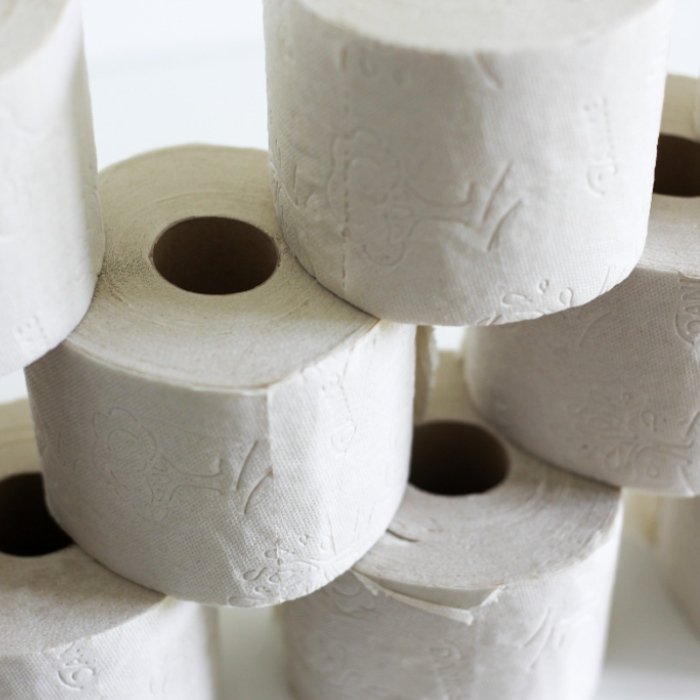
Find the location of `toilet paper rolls`. toilet paper rolls is located at coordinates (533, 120), (43, 127), (192, 182), (610, 402), (446, 592), (80, 647).